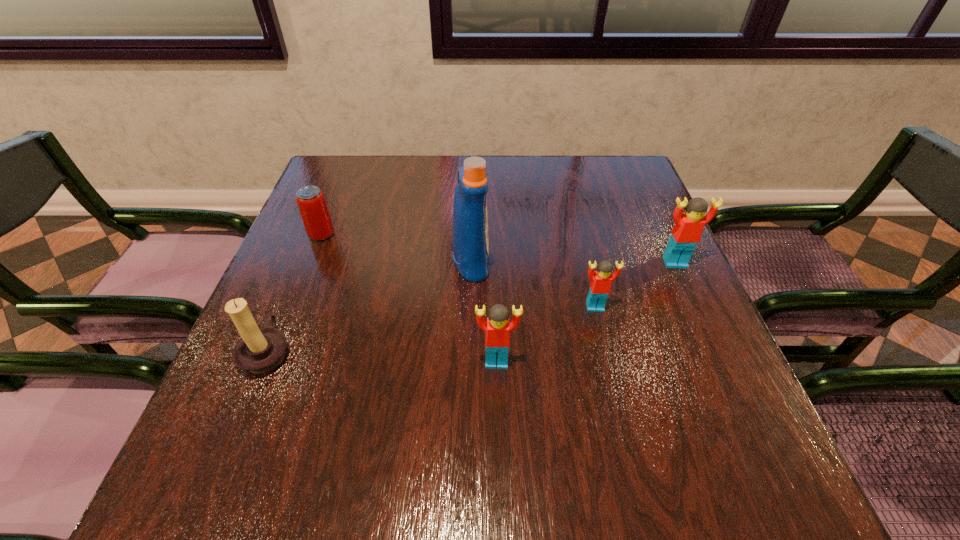
At what (x,y) coordinates should I click in order to perform the action: click on blank space at the left edge of the desktop. Please return your answer as a coordinate pair (x, y). Looking at the image, I should click on (304, 244).

Locate an element on the screen. This screenshot has height=540, width=960. vacant space at the right edge of the desktop is located at coordinates (623, 291).

Locate an element on the screen. This screenshot has width=960, height=540. blank space at the far left corner of the desktop is located at coordinates coord(356,188).

Identify the location of vacant space at the near left corner of the desktop. (290, 400).

You are a GUI agent. You are given a task and a screenshot of the screen. Output one action in this format:
    pyautogui.click(x=<x>, y=<y>)
    Task: Click on the free space at the far right corner of the desktop
    
    Given the screenshot: What is the action you would take?
    coord(611,191)

In order to click on vacant area that lies between the beer can and the candle holder in this screenshot , I will do `click(295, 293)`.

The image size is (960, 540). What are the coordinates of `vacant area that lies between the fourth farthest object and the candle holder` in the screenshot? It's located at (431, 329).

Find the location of `free spot between the candle holder and the tallest object`. free spot between the candle holder and the tallest object is located at coordinates (370, 306).

Locate an element on the screen. free space between the rightmost object and the beer can is located at coordinates (498, 248).

Locate an element on the screen. The height and width of the screenshot is (540, 960). vacant space that's between the candle holder and the tallest object is located at coordinates (370, 306).